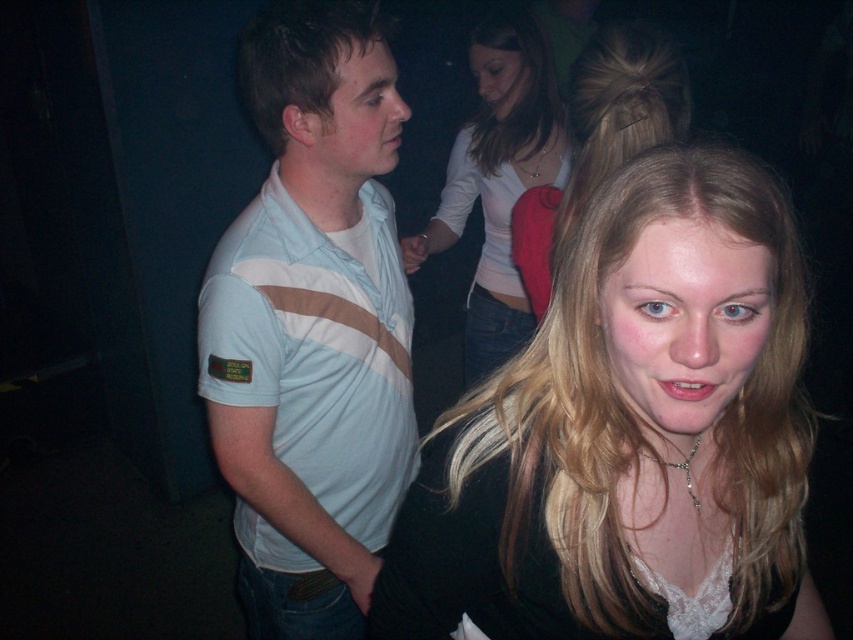
Question: Which point appears farthest from the camera in this image?

Choices:
 (A) (471, 406)
 (B) (486, 20)

Answer: (B)

Question: Which of the following is the closest to the observer?

Choices:
 (A) (538, 106)
 (B) (270, 144)

Answer: (B)

Question: Can you confirm if blonde hair at center is positioned below matte white shirt at center?

Choices:
 (A) no
 (B) yes

Answer: (B)

Question: Is light blue striped polo shirt at center in front of matte white shirt at center?

Choices:
 (A) yes
 (B) no

Answer: (A)

Question: Which of the following is the farthest from the observer?

Choices:
 (A) (292, 120)
 (B) (569, 148)
 (C) (767, 532)
 (D) (326, 74)

Answer: (B)

Question: Is matte white shirt at center to the left of matte white shirt at upper left from the viewer's perspective?

Choices:
 (A) yes
 (B) no

Answer: (B)